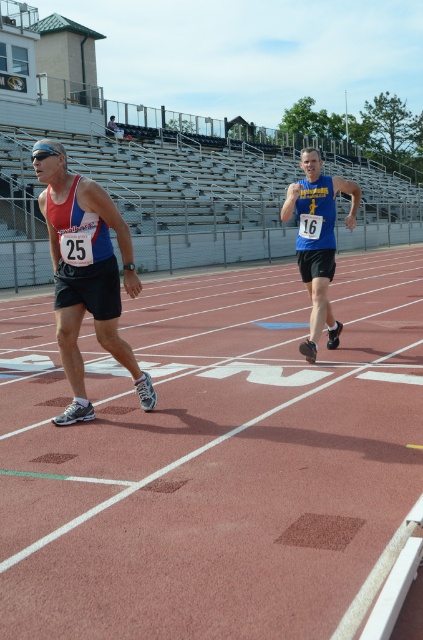
Can you confirm if rubberized track at center is positioned to the right of matte blue tank top at left?

Yes, rubberized track at center is to the right of matte blue tank top at left.

Does rubberized track at center come in front of matte blue tank top at left?

Yes, it is.

Locate an element on the screen. This screenshot has height=640, width=423. rubberized track at center is located at coordinates (213, 460).

Is matte blue tank top at left to the left of blue jersey at center from the viewer's perspective?

Indeed, matte blue tank top at left is positioned on the left side of blue jersey at center.

Which is behind, point (112, 330) or point (308, 150)?

The point (308, 150) is behind.

The image size is (423, 640). Find the location of `matte blue tank top at left`. matte blue tank top at left is located at coordinates (85, 273).

Does rubberized track at center have a larger size compared to blue jersey at center?

Yes.

Is rubberized track at center to the right of blue jersey at center from the viewer's perspective?

In fact, rubberized track at center is to the left of blue jersey at center.

Image resolution: width=423 pixels, height=640 pixels. What are the coordinates of `rubberized track at center` in the screenshot? It's located at (213, 460).

Identify the location of rubberized track at center. The image size is (423, 640). (213, 460).